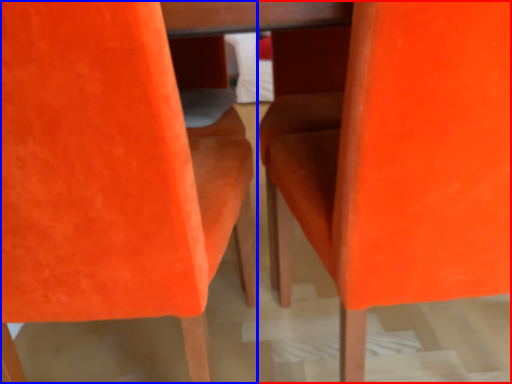
Question: Which point is further to the camera, chair (highlighted by a red box) or chair (highlighted by a blue box)?

Choices:
 (A) chair
 (B) chair

Answer: (A)